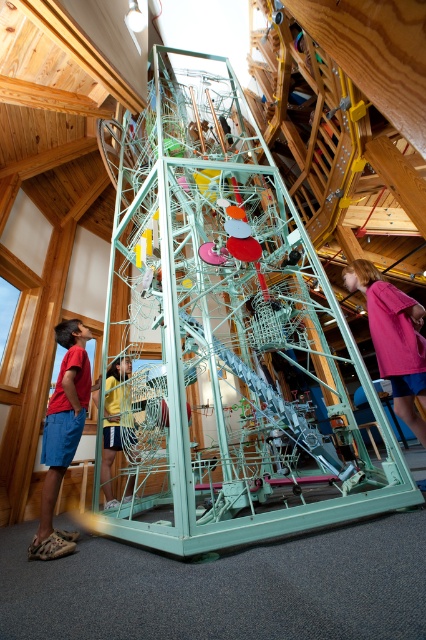
Can you confirm if matte red shirt at left is bigger than yellow fabric shorts at center?

Actually, matte red shirt at left might be smaller than yellow fabric shorts at center.

Between matte red shirt at left and yellow fabric shorts at center, which one appears on the right side from the viewer's perspective?

yellow fabric shorts at center

Who is more forward, (48, 426) or (112, 371)?

Point (48, 426)

You are a GUI agent. You are given a task and a screenshot of the screen. Output one action in this format:
    pyautogui.click(x=<x>, y=<y>)
    Task: Click on the matte red shirt at left
    
    Given the screenshot: What is the action you would take?
    pyautogui.click(x=63, y=435)

Is pink fabric shirt at lower right closer to the viewer compared to yellow fabric shorts at center?

That is True.

Locate an element on the screen. This screenshot has width=426, height=640. pink fabric shirt at lower right is located at coordinates (x=394, y=339).

Does matte red shirt at left appear under pink fabric shirt at lower right?

Indeed, matte red shirt at left is positioned under pink fabric shirt at lower right.

Is point (72, 444) more distant than point (391, 340)?

No, (72, 444) is closer to viewer.

Locate an element on the screen. The height and width of the screenshot is (640, 426). matte red shirt at left is located at coordinates (63, 435).